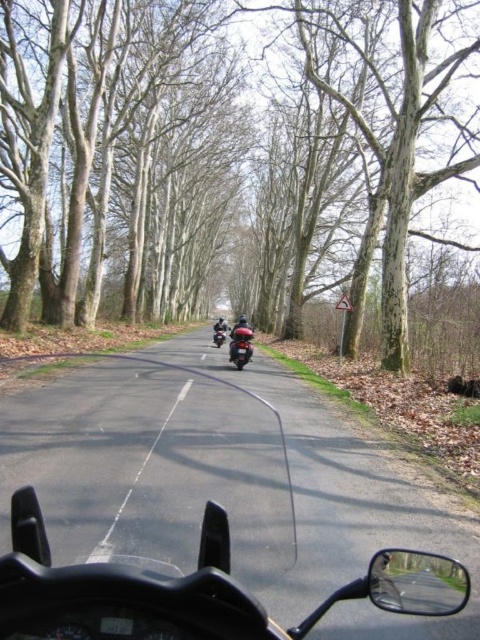
Can you confirm if smooth bark tree at center is positioned to the left of shiny black scooter at center?

Yes, smooth bark tree at center is to the left of shiny black scooter at center.

Looking at this image, measure the distance from smooth bark tree at center to shiny black scooter at center.

smooth bark tree at center is 19.35 meters from shiny black scooter at center.

Which is behind, point (28, 241) or point (241, 355)?

The point (28, 241) is more distant.

At what (x,y) coordinates should I click in order to perform the action: click on smooth bark tree at center. Please return your answer as a coordinate pair (x, y). Image resolution: width=480 pixels, height=640 pixels. Looking at the image, I should click on (227, 156).

Does white asphalt road at center have a greater width compared to shiny black scooter at center?

No, white asphalt road at center is not wider than shiny black scooter at center.

Is white asphalt road at center shorter than shiny black scooter at center?

Correct, white asphalt road at center is not as tall as shiny black scooter at center.

Where is `white asphalt road at center`? Image resolution: width=480 pixels, height=640 pixels. white asphalt road at center is located at coordinates (140, 472).

Who is positioned more to the right, shiny black motorcycle at center or black matte motorcycle at center?

black matte motorcycle at center

Is shiny black motorcycle at center to the right of black matte motorcycle at center from the viewer's perspective?

Incorrect, shiny black motorcycle at center is not on the right side of black matte motorcycle at center.

You are a GUI agent. You are given a task and a screenshot of the screen. Output one action in this format:
    pyautogui.click(x=<x>, y=<y>)
    Task: Click on the shiny black motorcycle at center
    The image size is (480, 640).
    Given the screenshot: What is the action you would take?
    pyautogui.click(x=219, y=333)

At what (x,y) coordinates should I click in order to perform the action: click on shiny black motorcycle at center. Please return your answer as a coordinate pair (x, y). This screenshot has width=480, height=640. Looking at the image, I should click on (219, 333).